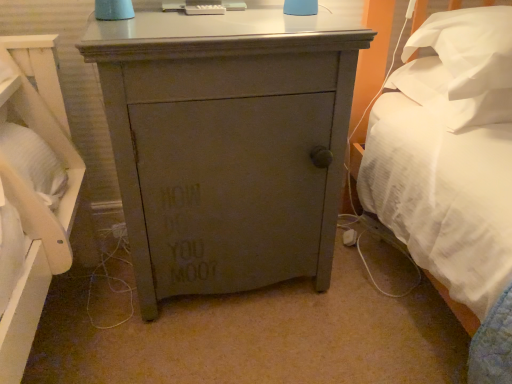
Question: Does white soft pillow at upper right, the 2th pillow when ordered from top to bottom, contain matte gray cabinet at center?

Choices:
 (A) yes
 (B) no

Answer: (B)

Question: Considering the relative positions of white soft pillow at upper right, the 2th pillow when ordered from top to bottom, and matte gray cabinet at center in the image provided, is white soft pillow at upper right, the 2th pillow when ordered from top to bottom, to the left of matte gray cabinet at center from the viewer's perspective?

Choices:
 (A) yes
 (B) no

Answer: (B)

Question: Is white soft pillow at upper right, the 2th pillow when ordered from top to bottom, oriented towards matte gray cabinet at center?

Choices:
 (A) yes
 (B) no

Answer: (B)

Question: Considering the relative sizes of white soft pillow at upper right, the 1th pillow when ordered from bottom to top, and matte gray cabinet at center in the image provided, is white soft pillow at upper right, the 1th pillow when ordered from bottom to top, wider than matte gray cabinet at center?

Choices:
 (A) no
 (B) yes

Answer: (A)

Question: Considering the positions of point (492, 41) and point (103, 36), is point (492, 41) closer or farther from the camera than point (103, 36)?

Choices:
 (A) farther
 (B) closer

Answer: (A)

Question: Choose the correct answer: Is white soft pillow at upper right, the first pillow in the top-to-bottom sequence, inside matte gray cabinet at center or outside it?

Choices:
 (A) outside
 (B) inside

Answer: (A)

Question: Would you say white soft pillow at upper right, the first pillow in the top-to-bottom sequence, is to the left or to the right of matte gray cabinet at center in the picture?

Choices:
 (A) left
 (B) right

Answer: (B)

Question: Looking at the image, does white soft pillow at upper right, marked as the second pillow in a bottom-to-top arrangement, seem bigger or smaller compared to matte gray cabinet at center?

Choices:
 (A) big
 (B) small

Answer: (B)

Question: Considering the positions of white soft pillow at upper right, marked as the second pillow in a bottom-to-top arrangement, and white soft pillow at upper right, the 2th pillow when ordered from top to bottom, in the image, is white soft pillow at upper right, marked as the second pillow in a bottom-to-top arrangement, bigger or smaller than white soft pillow at upper right, the 2th pillow when ordered from top to bottom,?

Choices:
 (A) small
 (B) big

Answer: (B)

Question: Is point (473, 84) closer or farther from the camera than point (449, 125)?

Choices:
 (A) farther
 (B) closer

Answer: (B)

Question: From their relative heights in the image, would you say white soft pillow at upper right, marked as the second pillow in a bottom-to-top arrangement, is taller or shorter than white soft pillow at upper right, the 1th pillow when ordered from bottom to top?

Choices:
 (A) tall
 (B) short

Answer: (A)

Question: Visually, is white soft pillow at upper right, the first pillow in the top-to-bottom sequence, positioned to the left or to the right of white soft pillow at upper right, the 2th pillow when ordered from top to bottom?

Choices:
 (A) right
 (B) left

Answer: (A)

Question: In terms of size, does matte gray cabinet at center appear bigger or smaller than white soft pillow at upper right, the 2th pillow when ordered from top to bottom?

Choices:
 (A) big
 (B) small

Answer: (A)

Question: Considering their positions, is matte gray cabinet at center located in front of or behind white soft pillow at upper right, the 2th pillow when ordered from top to bottom?

Choices:
 (A) behind
 (B) front

Answer: (B)